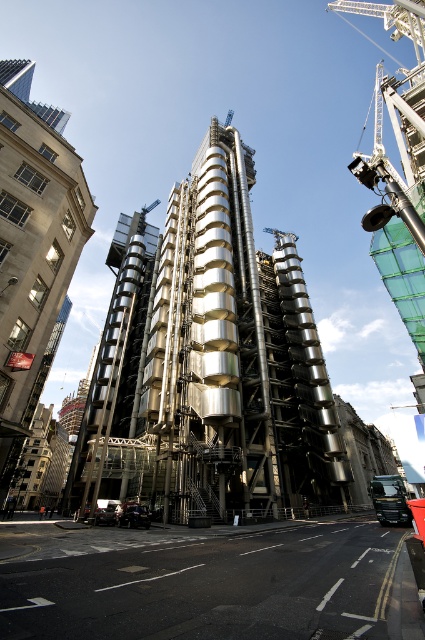
You are an urban planner assessing the space between the metallic silver tower at center and the silver metallic building at left. Given that the tower is narrower, would a 10m wide truck be able to pass through the space between them?

The metallic silver tower at center is narrower than the silver metallic building at left, but the exact width of the space between them isn not specified. Without knowing the actual distance, it is impossible to determine if a 10m wide truck can pass through.

You are an urban planner assessing the space around the Lloyd building. You need to determine which of the two structures, the metallic silver tower at center or the silver metallic building at left, would be easier to expand horizontally without affecting the other. Based on their spatial footprint, which one has more room to grow outward?

The metallic silver tower at center occupies less space than the silver metallic building at left, so it has more room to grow outward without affecting the other structure.